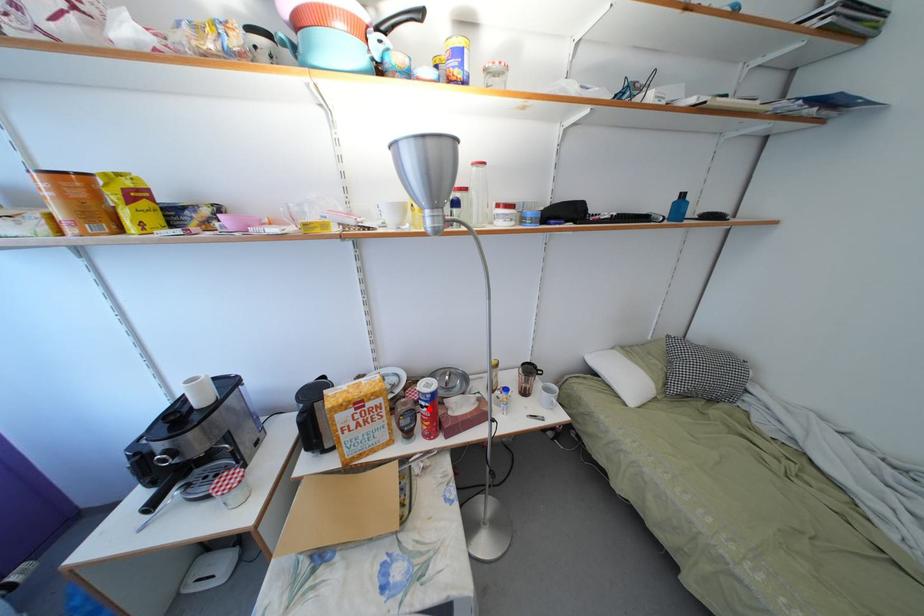
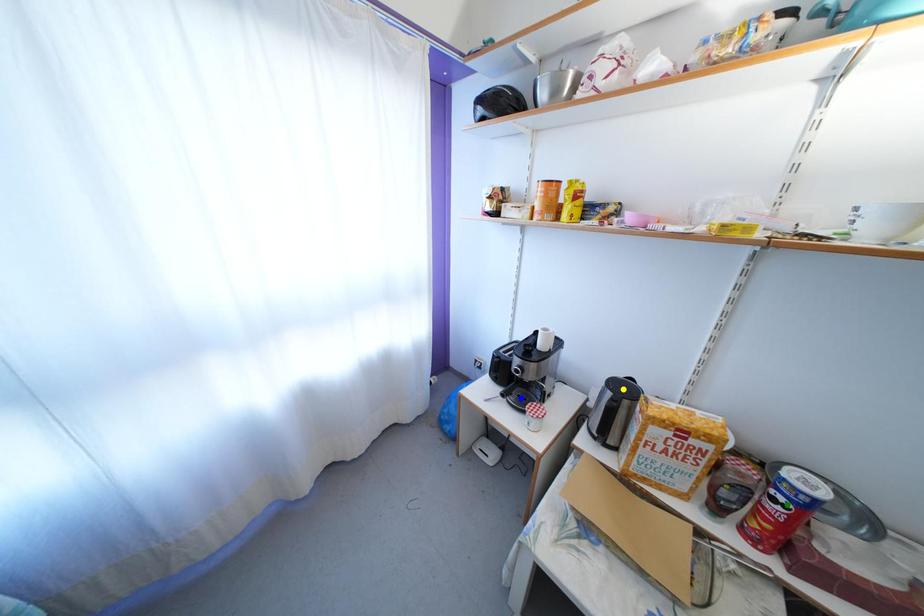
Question: I am providing you with two images of the same scene from different viewpoints. A red point is marked on the first image. You are given multiple points on the second image. Which point in image 2 is actually the same real-world point as the red point in image 1?

Choices:
 (A) yellow point
 (B) green point
 (C) blue point

Answer: (B)